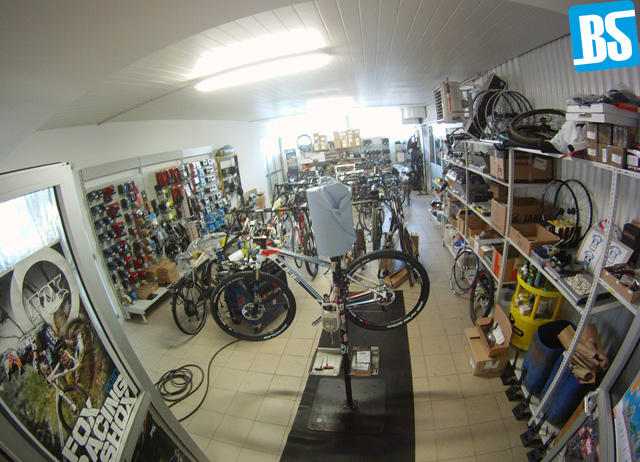
I want to click on tile, so coord(435,402).